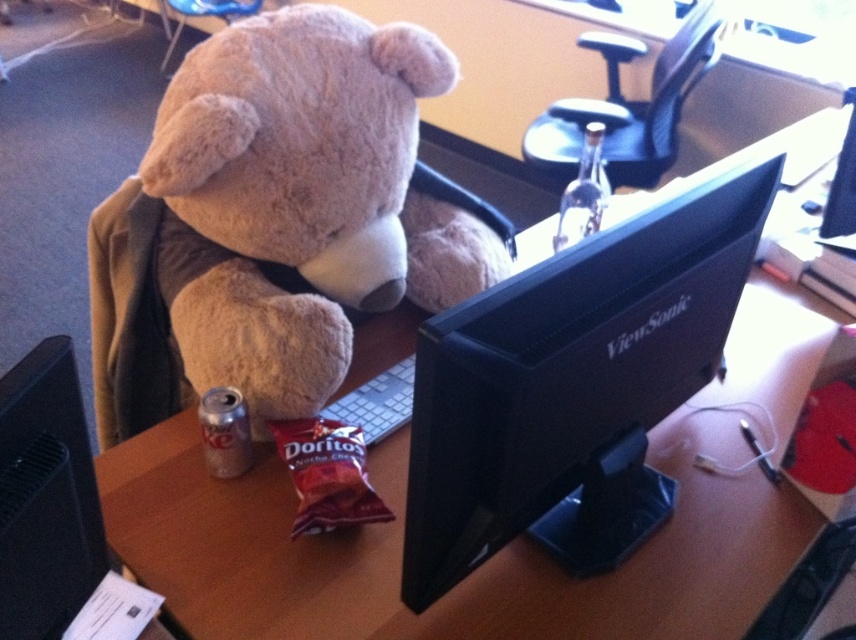
You are organizing the desk and want to place a new item between the soft plush teddy bear at left and the black matte viewsonic monitor at center. Based on their positions, where should you position the new item?

The soft plush teddy bear at left is above the black matte viewsonic monitor at center, so to place an item between them, you should position it below the teddy bear but above the monitor.

You are a delivery robot with a 12 inch wide package. You need to place it on the desk between the soft plush teddy bear at left and the black matte viewsonic monitor at center. Is there enough space between them to fit the package?

The distance between the soft plush teddy bear at left and the black matte viewsonic monitor at center is 16.96 inches. Since the package is 12 inches wide, there is enough space to fit it between them.